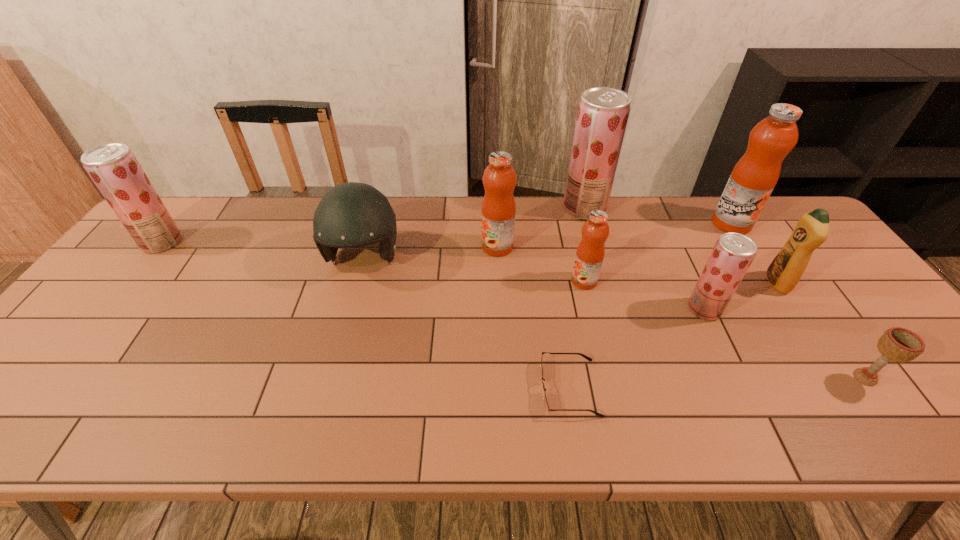
This screenshot has width=960, height=540. Find the location of `the biggest strawberry fruit juice`. the biggest strawberry fruit juice is located at coordinates (603, 112).

I want to click on the farthest strawberry fruit juice, so click(x=603, y=112).

The height and width of the screenshot is (540, 960). Identify the location of the rightmost fruit juice. (755, 175).

Where is `the biggest orange fruit juice`? This screenshot has height=540, width=960. the biggest orange fruit juice is located at coordinates (755, 175).

At what (x,y) coordinates should I click in order to perform the action: click on the leftmost fruit juice. Please return your answer as a coordinate pair (x, y). Looking at the image, I should click on (113, 167).

The height and width of the screenshot is (540, 960). I want to click on the second farthest strawberry fruit juice, so click(x=113, y=167).

Locate an element on the screen. The image size is (960, 540). the second nearest orange fruit juice is located at coordinates (498, 210).

Find the location of a particular element. The height and width of the screenshot is (540, 960). the third object from left to right is located at coordinates (498, 210).

At what (x,y) coordinates should I click in order to perform the action: click on detergent. Please return your answer as a coordinate pair (x, y). Looking at the image, I should click on (786, 269).

Locate an element on the screen. green football helmet is located at coordinates (352, 214).